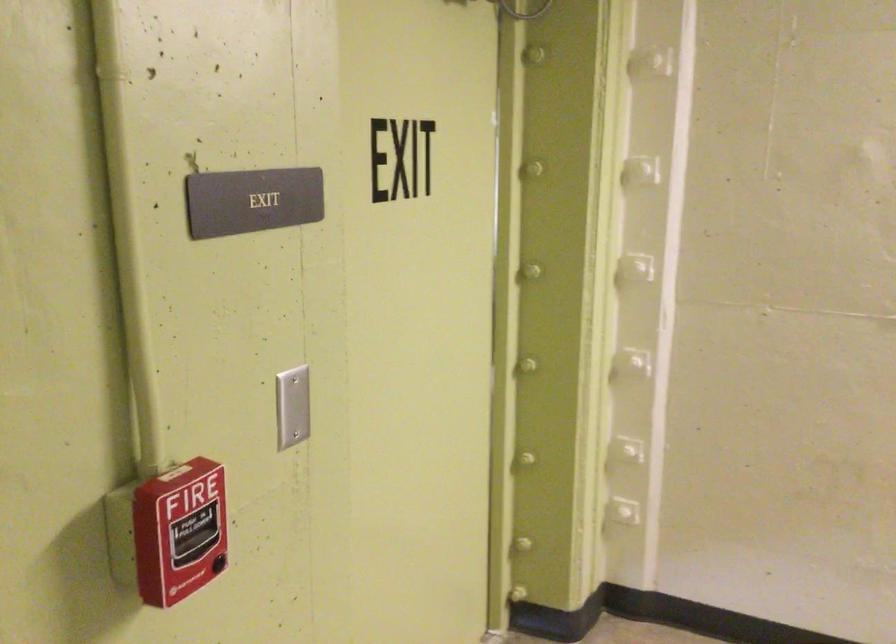
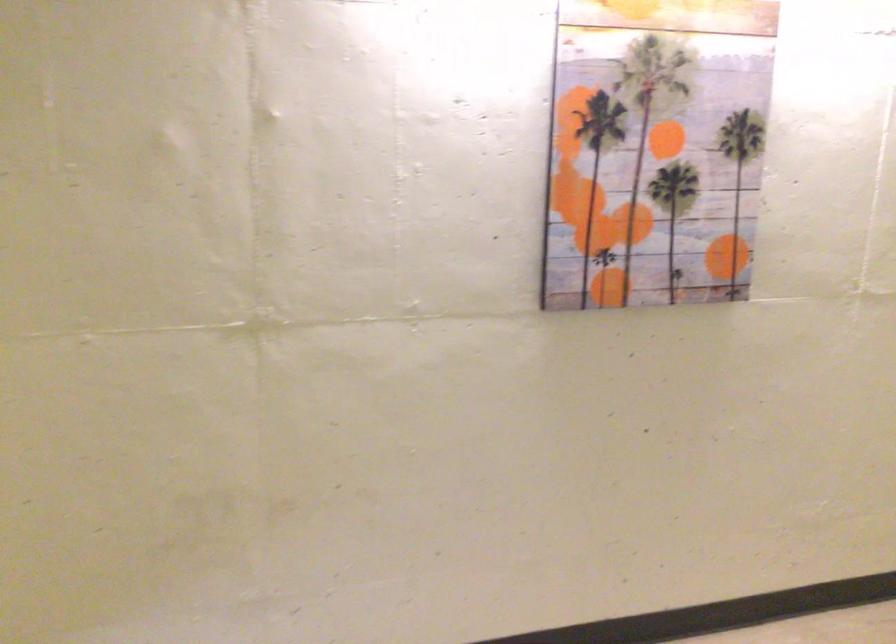
Question: Based on the continuous images, in which direction is the camera rotating? Reply with the corresponding letter.

Choices:
 (A) Left
 (B) Right
 (C) Up
 (D) Down

Answer: (B)